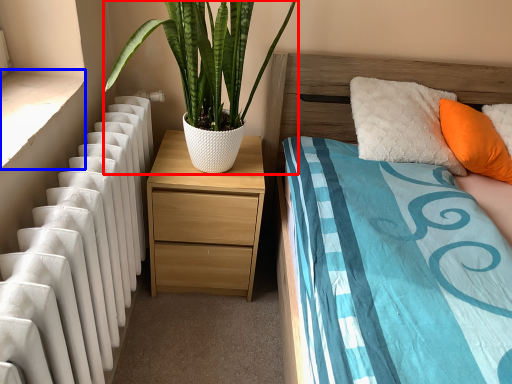
Question: Which point is further to the camera, houseplant (highlighted by a red box) or window sill (highlighted by a blue box)?

Choices:
 (A) houseplant
 (B) window sill

Answer: (A)